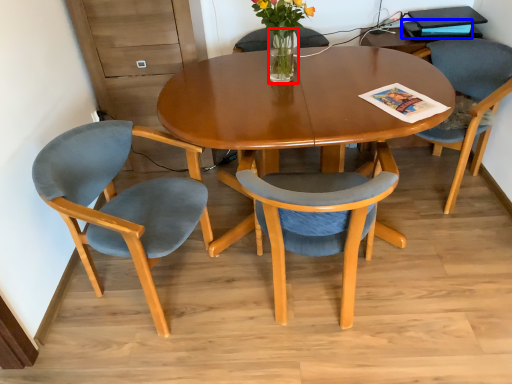
Question: Which point is closer to the camera, vase (highlighted by a red box) or magazine (highlighted by a blue box)?

Choices:
 (A) vase
 (B) magazine

Answer: (A)